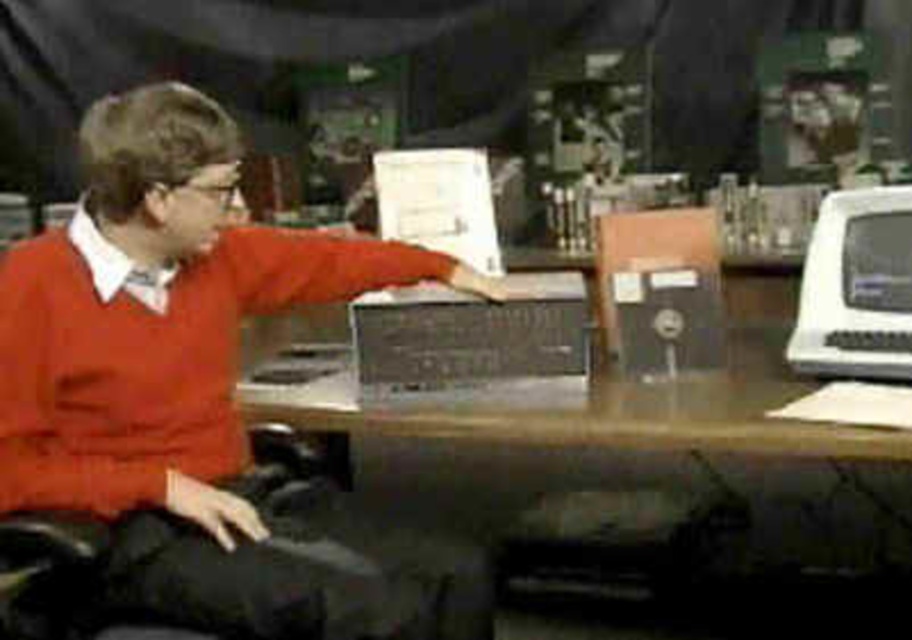
You are organizing a desk and need to place a monitor between the wooden at center and the white plastic desktop computer at right. Which object should the monitor be placed closer to to ensure it fits within the available space?

The wooden at center has a greater width than the white plastic desktop computer at right. Therefore, the monitor should be placed closer to the white plastic desktop computer at right to accommodate the space constraints.

You are organizing a display and need to place both the matte orange sweater at center and the white plastic desktop computer at right on a shelf. If the shelf has a width of 1 meter, can both items fit side by side without overlapping?

The matte orange sweater at center is wider than the white plastic desktop computer at right. However, since the shelf is 1 meter wide, it is possible that both items can fit side by side if their combined widths do not exceed 1 meter. Without specific measurements, we can only confirm that the sweater is wider, but not whether the total width exceeds the shelf space.

You are organizing the desk in the image. You need to move the wooden at center and the white plastic desktop computer at right so that the computer is now on the left side of the wooden. Is this possible without moving any other items?

The wooden at center is positioned on the left side of white plastic desktop computer at right, so to move the computer to the left of the wooden would require swapping their positions. Since there is no mention of space constraints or other items blocking the area, it should be possible as long as there is enough space between them to slide or reposition the objects without disturbing other items on the desk.